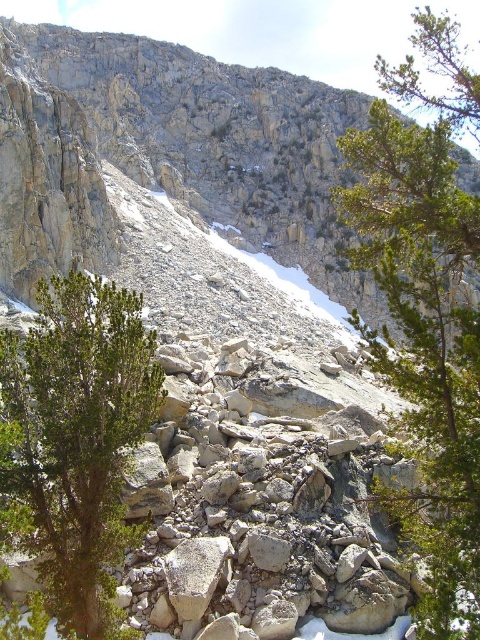
You are a hiker trying to navigate through the rocky terrain. You see the rough gray rock at center and the green leafy tree at center. Which object would you need to avoid stepping on to prevent slipping due to its smooth surface?

The rough gray rock at center might be wider than the green leafy tree at center, so the rough gray rock at center has a smoother surface and should be avoided to prevent slipping.

You are a hiker trying to cross this rocky area. You see the rough gray rock at center and the green leafy shrub at left. Which object is wider?

The rough gray rock at center is wider than the green leafy shrub at left according to the description.